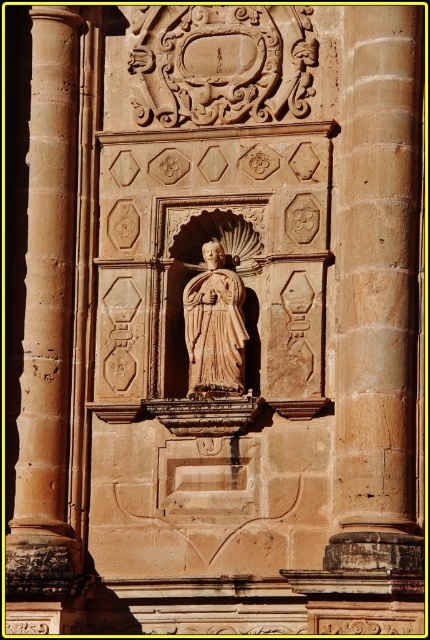
You are an architect examining the facade. You need to determine which object, the smooth stone pillar at center or the beige stone statue at center, requires more material for restoration. Based on their sizes, which one would need more material?

The smooth stone pillar at center is larger in size than the beige stone statue at center, so it would require more material for restoration.

You are an architect analyzing the symmetry of the facade. Given that the smooth stone pillar at center is positioned at coordinates 0.461 on the x and 0.879 on the y axis, does it align with the central axis of the facade?

The smooth stone pillar at center is located at coordinates 0.461 on the x and 0.879 on the y axis. Since the central axis of a symmetrical facade would typically be at x coordinate 0.5, the pillar is very close to the central axis, likely aligned with it.

You are an architect examining the facade of a historical building. You notice the smooth stone pillar at center and the beige stone statue at center. Based on their positions, which one is located higher up on the facade?

The smooth stone pillar at center is above the beige stone statue at center, so it is located higher up on the facade.